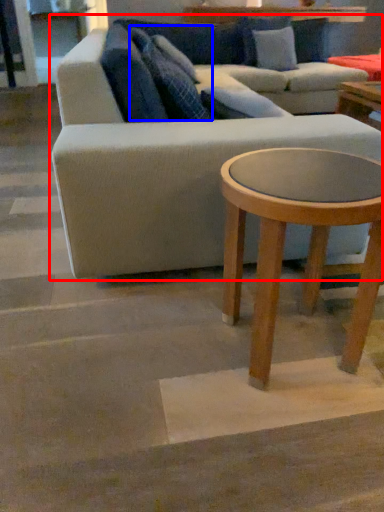
Question: Which object appears farthest to the camera in this image, studio couch (highlighted by a red box) or pillow (highlighted by a blue box)?

Choices:
 (A) studio couch
 (B) pillow

Answer: (B)